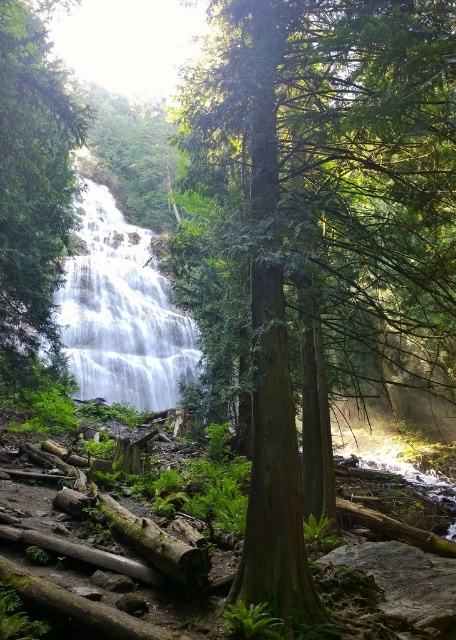
How far apart are green smooth tree at center and white smooth waterfall at center?

green smooth tree at center and white smooth waterfall at center are 8.04 meters apart from each other.

Which is below, green smooth tree at center or white smooth waterfall at center?

green smooth tree at center is lower down.

What do you see at coordinates (325, 220) in the screenshot? The height and width of the screenshot is (640, 456). I see `green smooth tree at center` at bounding box center [325, 220].

Image resolution: width=456 pixels, height=640 pixels. Identify the location of green smooth tree at center. (325, 220).

Who is shorter, green smooth tree at center or green matte tree at left?

green smooth tree at center is shorter.

Between point (357, 333) and point (42, 166), which one is positioned behind?

The point (42, 166) is more distant.

Which is in front, point (409, 88) or point (46, 179)?

Point (409, 88) is more forward.

Identify the location of green smooth tree at center. The width and height of the screenshot is (456, 640). (325, 220).

Is green matte tree at left to the right of white smooth waterfall at center from the viewer's perspective?

Indeed, green matte tree at left is positioned on the right side of white smooth waterfall at center.

Between point (48, 353) and point (67, 353), which one is positioned behind?

The point (67, 353) is behind.

At what (x,y) coordinates should I click in order to perform the action: click on green matte tree at left. Please return your answer as a coordinate pair (x, y). Looking at the image, I should click on (32, 188).